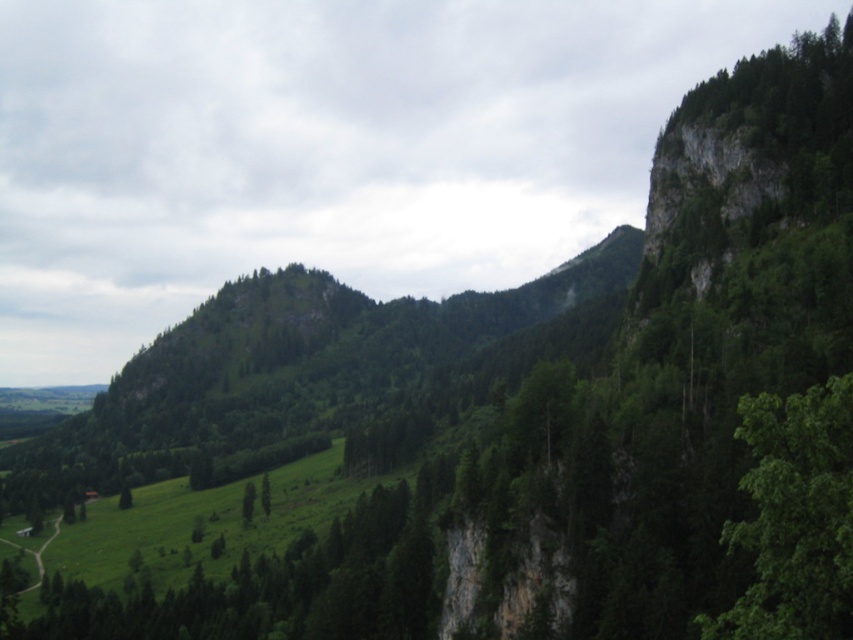
Question: Among these objects, which one is farthest from the camera?

Choices:
 (A) green leafy tree at lower center
 (B) green leafy tree at right
 (C) green matte tree at center

Answer: (C)

Question: Which of the following is the farthest from the observer?

Choices:
 (A) green matte tree at center
 (B) green leafy tree at lower center

Answer: (A)

Question: From the image, what is the correct spatial relationship of green leafy tree at right in relation to green matte tree at center?

Choices:
 (A) left
 (B) right

Answer: (B)

Question: Can you confirm if green leafy tree at right is positioned to the right of green matte tree at center?

Choices:
 (A) no
 (B) yes

Answer: (B)

Question: Is green leafy tree at right to the right of green leafy tree at lower center from the viewer's perspective?

Choices:
 (A) no
 (B) yes

Answer: (B)

Question: Among these points, which one is farthest from the camera?

Choices:
 (A) (263, 476)
 (B) (805, 433)
 (C) (242, 497)

Answer: (A)